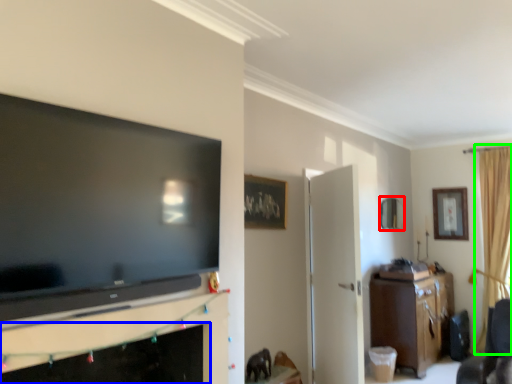
Question: Considering the real-world distances, which object is closest to picture frame (highlighted by a red box)? fireplace (highlighted by a blue box) or curtain (highlighted by a green box).

Choices:
 (A) fireplace
 (B) curtain

Answer: (B)